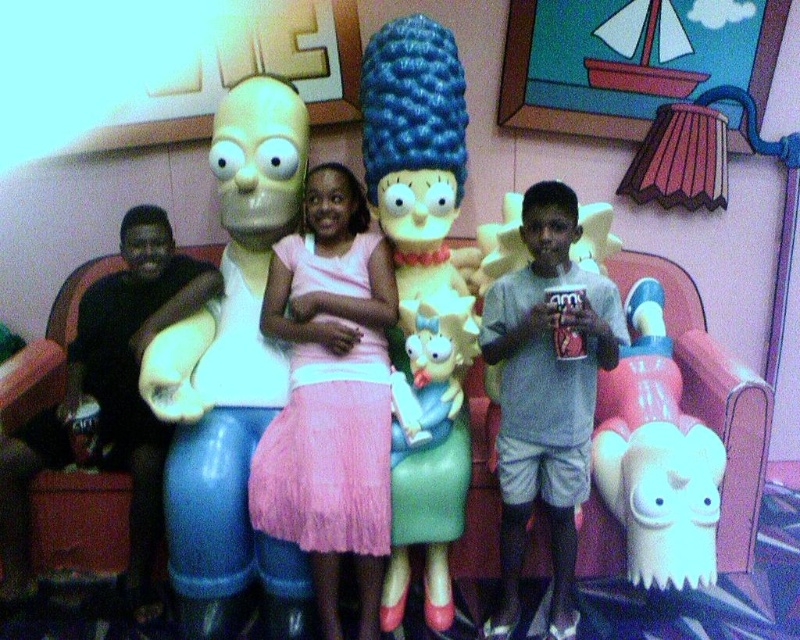
Question: From the image, what is the correct spatial relationship of smooth plastic homer simpson at left in relation to pink tulle skirt at center?

Choices:
 (A) left
 (B) right

Answer: (A)

Question: Which object appears farthest from the camera in this image?

Choices:
 (A) gray cotton shirt at center
 (B) smooth plastic homer simpson at left
 (C) smooth plastic doll at center

Answer: (C)

Question: Considering the real-world distances, which object is closest to the smooth plastic doll at center?

Choices:
 (A) pink tulle skirt at center
 (B) gray cotton shirt at center
 (C) white matte toy at lower right

Answer: (A)

Question: Is smooth plastic doll at center above white matte toy at lower right?

Choices:
 (A) yes
 (B) no

Answer: (A)

Question: Does pink tulle skirt at center appear on the left side of gray cotton shirt at center?

Choices:
 (A) no
 (B) yes

Answer: (B)

Question: Which object is farther from the camera taking this photo?

Choices:
 (A) white matte toy at lower right
 (B) gray cotton shirt at center

Answer: (A)